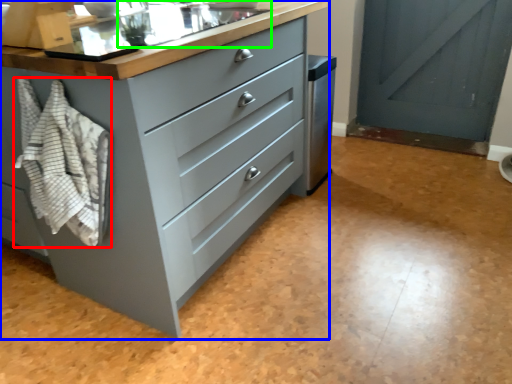
Question: Which is nearer to the blanket (highlighted by a red box)? chest of drawers (highlighted by a blue box) or sink (highlighted by a green box).

Choices:
 (A) chest of drawers
 (B) sink

Answer: (A)